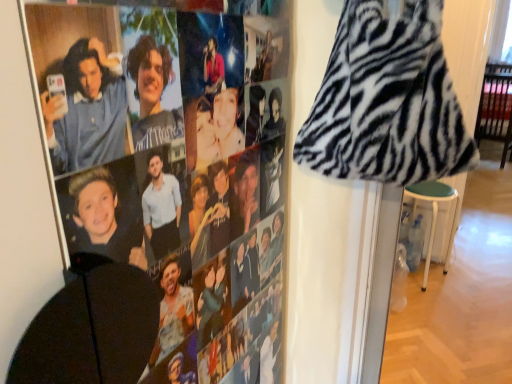
Question: From a real-world perspective, is zebra print hoodie at upper left located higher than green fabric stool at lower right?

Choices:
 (A) yes
 (B) no

Answer: (A)

Question: Is zebra print hoodie at upper left outside of green fabric stool at lower right?

Choices:
 (A) no
 (B) yes

Answer: (B)

Question: From the image's perspective, would you say zebra print hoodie at upper left is shown under green fabric stool at lower right?

Choices:
 (A) no
 (B) yes

Answer: (A)

Question: Can you confirm if zebra print hoodie at upper left is shorter than green fabric stool at lower right?

Choices:
 (A) yes
 (B) no

Answer: (B)

Question: Could green fabric stool at lower right be considered to be inside zebra print hoodie at upper left?

Choices:
 (A) yes
 (B) no

Answer: (B)

Question: In terms of height, does zebra print fabric at upper right look taller or shorter compared to zebra print hoodie at upper left?

Choices:
 (A) tall
 (B) short

Answer: (B)

Question: Based on their positions, is zebra print fabric at upper right located to the left or right of zebra print hoodie at upper left?

Choices:
 (A) left
 (B) right

Answer: (B)

Question: Is zebra print fabric at upper right wider or thinner than zebra print hoodie at upper left?

Choices:
 (A) thin
 (B) wide

Answer: (B)

Question: From a real-world perspective, is zebra print fabric at upper right above or below zebra print hoodie at upper left?

Choices:
 (A) above
 (B) below

Answer: (A)

Question: Is green fabric stool at lower right situated inside zebra print hoodie at upper left or outside?

Choices:
 (A) outside
 (B) inside

Answer: (A)

Question: Relative to zebra print hoodie at upper left, is green fabric stool at lower right in front or behind?

Choices:
 (A) front
 (B) behind

Answer: (B)

Question: Is green fabric stool at lower right wider or thinner than zebra print hoodie at upper left?

Choices:
 (A) thin
 (B) wide

Answer: (B)

Question: Looking at the image, does green fabric stool at lower right seem bigger or smaller compared to zebra print hoodie at upper left?

Choices:
 (A) big
 (B) small

Answer: (A)

Question: In terms of width, does green fabric stool at lower right look wider or thinner when compared to zebra print fabric at upper right?

Choices:
 (A) thin
 (B) wide

Answer: (B)

Question: Is green fabric stool at lower right situated inside zebra print fabric at upper right or outside?

Choices:
 (A) outside
 (B) inside

Answer: (A)